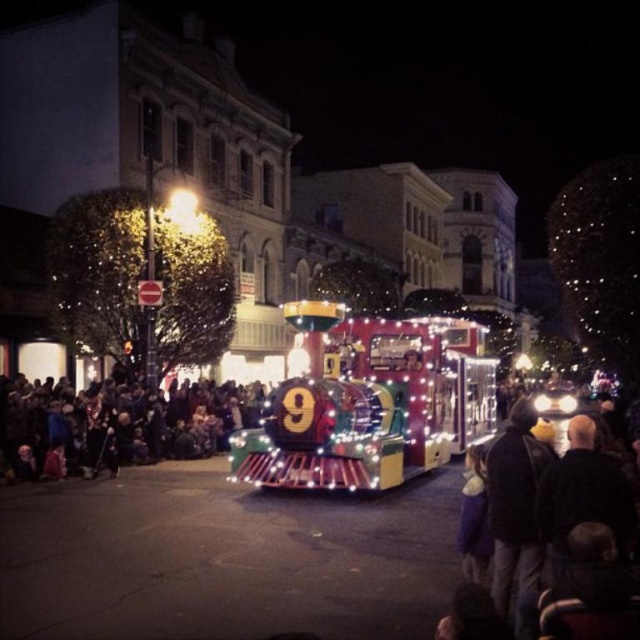
Who is positioned more to the left, dark brown hair at center or dark gray hoodie at center?

Positioned to the left is dark brown hair at center.

Can you confirm if dark brown hair at center is bigger than dark gray hoodie at center?

Yes.

You are a GUI agent. You are given a task and a screenshot of the screen. Output one action in this format:
    pyautogui.click(x=<x>, y=<y>)
    Task: Click on the dark brown hair at center
    The width and height of the screenshot is (640, 640).
    Given the screenshot: What is the action you would take?
    coord(113,426)

Does dark blue jacket at center appear over dark gray hoodie at center?

Indeed, dark blue jacket at center is positioned over dark gray hoodie at center.

Which is below, dark blue jacket at center or dark gray hoodie at center?

Positioned lower is dark gray hoodie at center.

Does point (506, 536) come closer to viewer compared to point (509, 488)?

Yes, point (506, 536) is in front of point (509, 488).

This screenshot has width=640, height=640. Identify the location of dark blue jacket at center. (548, 504).

Describe the element at coordinates (113, 426) in the screenshot. The width and height of the screenshot is (640, 640). I see `dark brown hair at center` at that location.

Which is behind, point (83, 428) or point (580, 476)?

Positioned behind is point (83, 428).

Locate an element on the screen. The image size is (640, 640). dark brown hair at center is located at coordinates (113, 426).